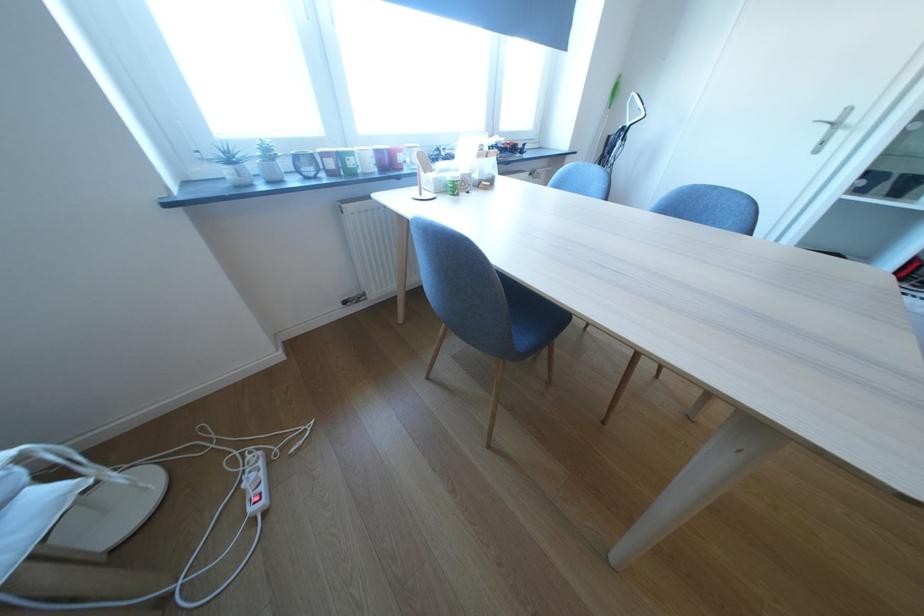
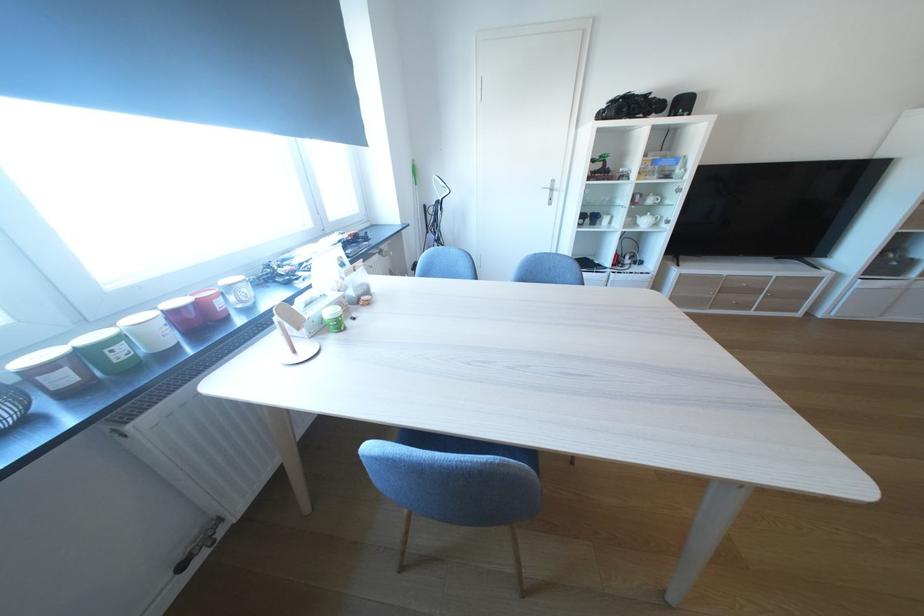
The point at (361, 164) is marked in the first image. Where is the corresponding point in the second image?

(129, 354)